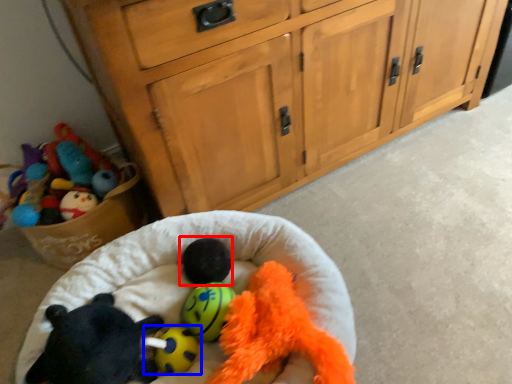
Question: Which object is further to the camera taking this photo, animal (highlighted by a red box) or toy (highlighted by a blue box)?

Choices:
 (A) animal
 (B) toy

Answer: (A)